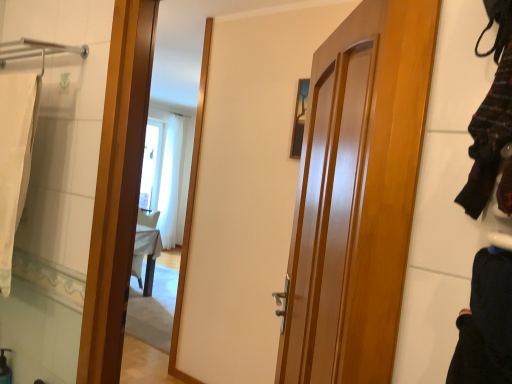
Question: From their relative heights in the image, would you say white fabric bath towel at left is taller or shorter than black cotton pants at lower right, arranged as the second clothing when viewed from the top?

Choices:
 (A) tall
 (B) short

Answer: (A)

Question: Considering the positions of point (12, 168) and point (478, 253), is point (12, 168) closer or farther from the camera than point (478, 253)?

Choices:
 (A) closer
 (B) farther

Answer: (B)

Question: Based on their relative distances, which object is nearer to the white fabric bath towel at left?

Choices:
 (A) glossy wood door at center
 (B) black cotton pants at lower right, arranged as the second clothing when viewed from the top
 (C) striped wool sweater at right, the first clothing positioned from the top

Answer: (A)

Question: Which object is the farthest from the glossy wood door at center?

Choices:
 (A) black cotton pants at lower right, arranged as the second clothing when viewed from the top
 (B) white fabric bath towel at left
 (C) striped wool sweater at right, the 2th clothing positioned from the bottom

Answer: (B)